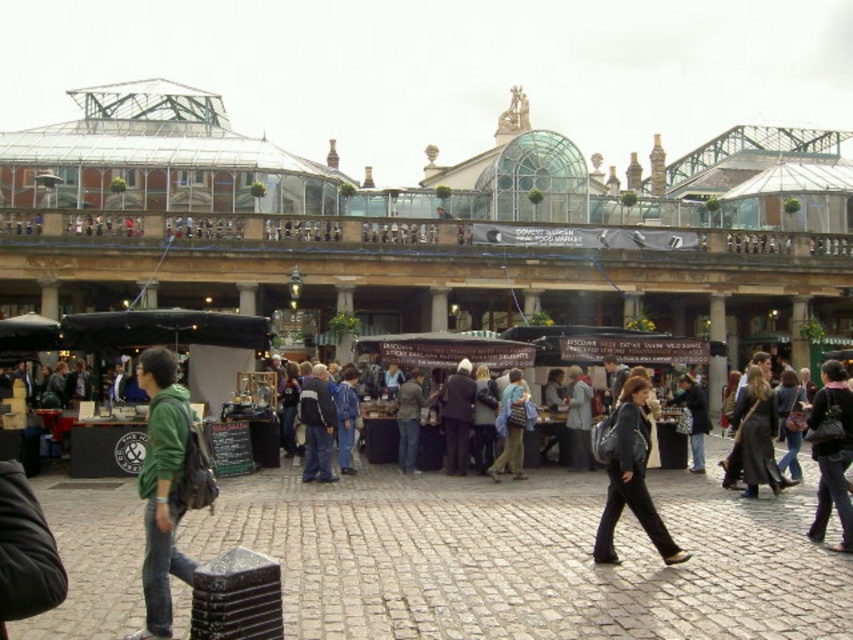
Question: Does dark brown leather coat at center have a larger size compared to dark gray suit at center?

Choices:
 (A) yes
 (B) no

Answer: (A)

Question: Which point is farther from the camera taking this photo?

Choices:
 (A) (521, 468)
 (B) (413, 451)
 (C) (173, 458)
 (D) (614, 561)

Answer: (B)

Question: Which object appears closest to the camera in this image?

Choices:
 (A) dark gray leather jacket at center
 (B) dark gray suit at center
 (C) dark brown leather coat at center

Answer: (A)

Question: Does dark gray leather jacket at center appear over dark gray suit at center?

Choices:
 (A) no
 (B) yes

Answer: (A)

Question: Considering the real-world distances, which object is farthest from the dark gray suit at center?

Choices:
 (A) green matte jacket at center
 (B) denim jacket at center
 (C) dark brown leather coat at center

Answer: (A)

Question: Where is dark blue jeans at lower right located in relation to dark brown leather coat at center in the image?

Choices:
 (A) right
 (B) left

Answer: (A)